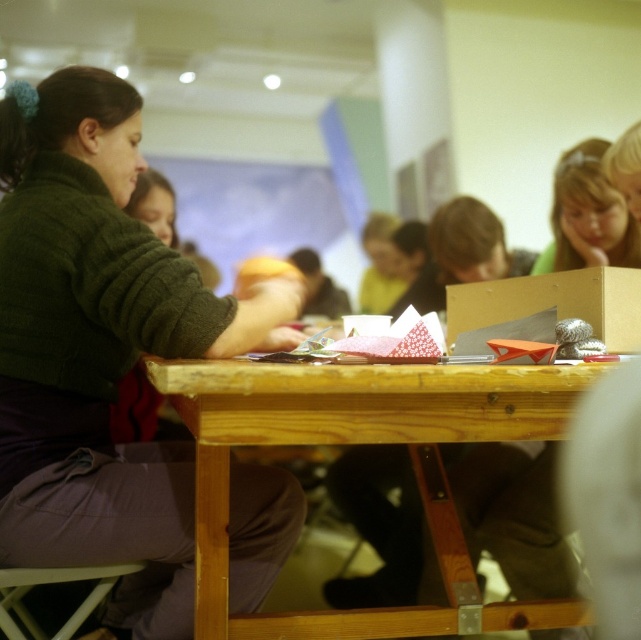
Does smooth skin face at upper right have a greater width compared to wooden stool at lower left?

No, smooth skin face at upper right is not wider than wooden stool at lower left.

Measure the distance between smooth skin face at upper right and wooden stool at lower left.

4.68 feet

Is point (563, 244) farther from viewer compared to point (63, 572)?

Yes, it is behind point (63, 572).

The image size is (641, 640). What are the coordinates of `smooth skin face at upper right` in the screenshot? It's located at (588, 216).

Does wooden table at center appear on the right side of smooth skin face at upper right?

Incorrect, wooden table at center is not on the right side of smooth skin face at upper right.

Between wooden table at center and smooth skin face at upper right, which one appears on the left side from the viewer's perspective?

From the viewer's perspective, wooden table at center appears more on the left side.

Which is in front, point (231, 358) or point (595, 138)?

Point (231, 358) is in front.

The height and width of the screenshot is (640, 641). I want to click on wooden table at center, so click(x=353, y=442).

Which is in front, point (215, 300) or point (487, 618)?

Point (215, 300) is in front.

Does green fuzzy sweater at left appear on the left side of wooden table at center?

Indeed, green fuzzy sweater at left is positioned on the left side of wooden table at center.

Is point (192, 621) in front of point (354, 634)?

No, (192, 621) is behind (354, 634).

Identify the location of green fuzzy sweater at left. (99, 346).